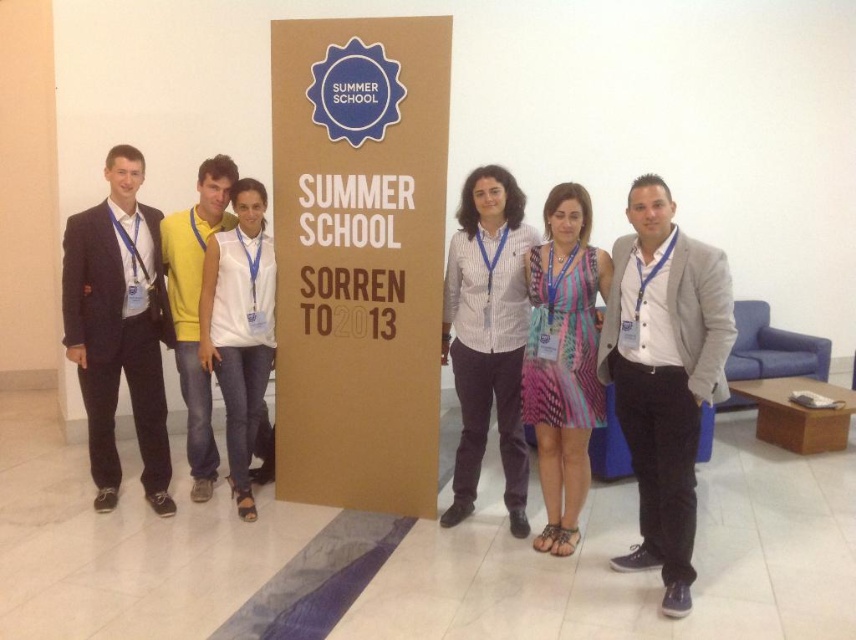
Question: Can you confirm if gray fabric blazer at center is positioned to the right of white matte shirt at center?

Choices:
 (A) no
 (B) yes

Answer: (B)

Question: In this image, where is brown cardboard sign at center located relative to gray fabric blazer at center?

Choices:
 (A) left
 (B) right

Answer: (A)

Question: Which object appears farthest from the camera in this image?

Choices:
 (A) white striped shirt at center
 (B) gray fabric blazer at center
 (C) striped fabric dress at center
 (D) black suit at left

Answer: (D)

Question: Among these objects, which one is nearest to the camera?

Choices:
 (A) white striped shirt at center
 (B) white matte shirt at center
 (C) gray fabric blazer at center

Answer: (C)

Question: Which point is farther to the camera?

Choices:
 (A) (672, 358)
 (B) (205, 257)

Answer: (B)

Question: Does striped fabric dress at center appear on the left side of white matte shirt at center?

Choices:
 (A) no
 (B) yes

Answer: (A)